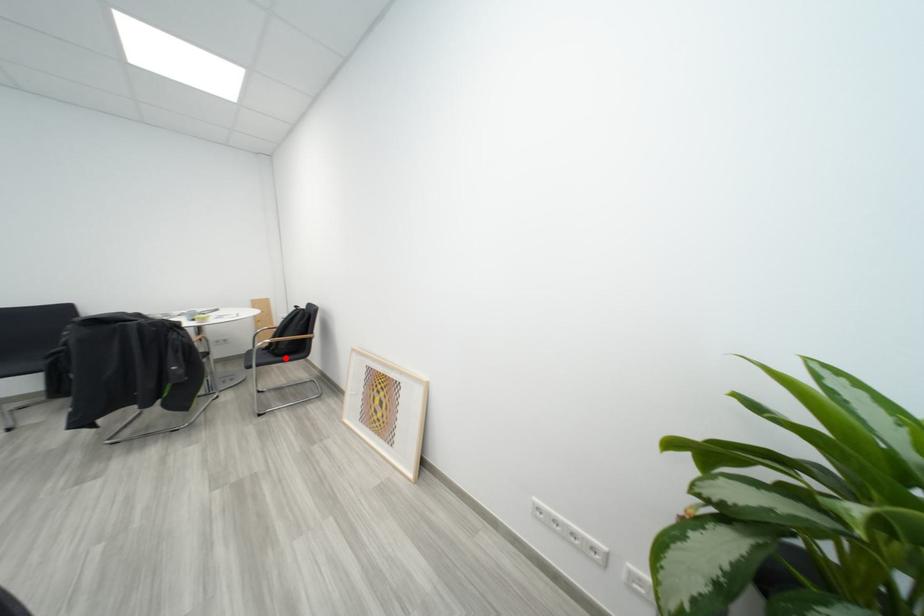
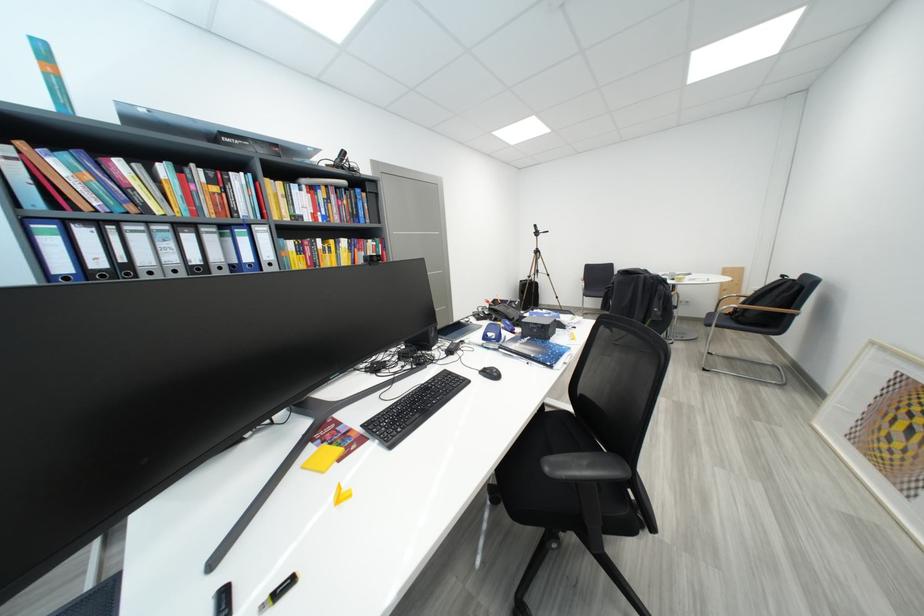
The point at the highlighted location is marked in the first image. Where is the corresponding point in the second image?

(748, 325)